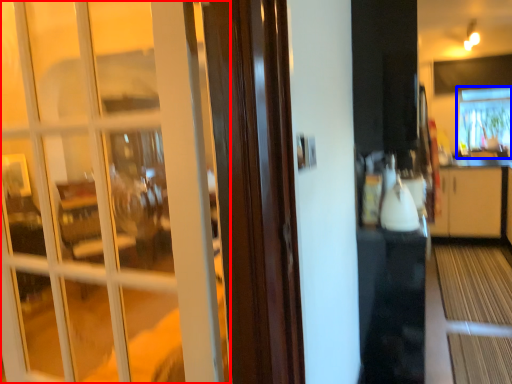
Question: Which of the following is the farthest to the observer, door (highlighted by a red box) or window (highlighted by a blue box)?

Choices:
 (A) door
 (B) window

Answer: (B)